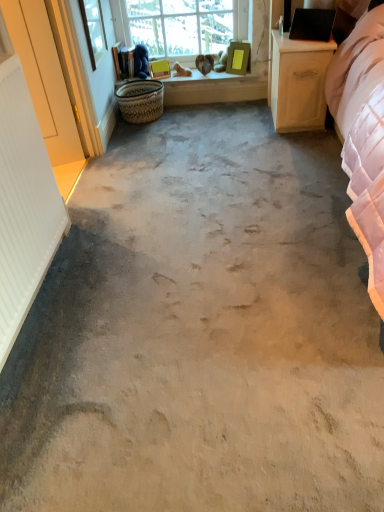
The width and height of the screenshot is (384, 512). I want to click on free point in front of woven natural basket at center, so click(147, 134).